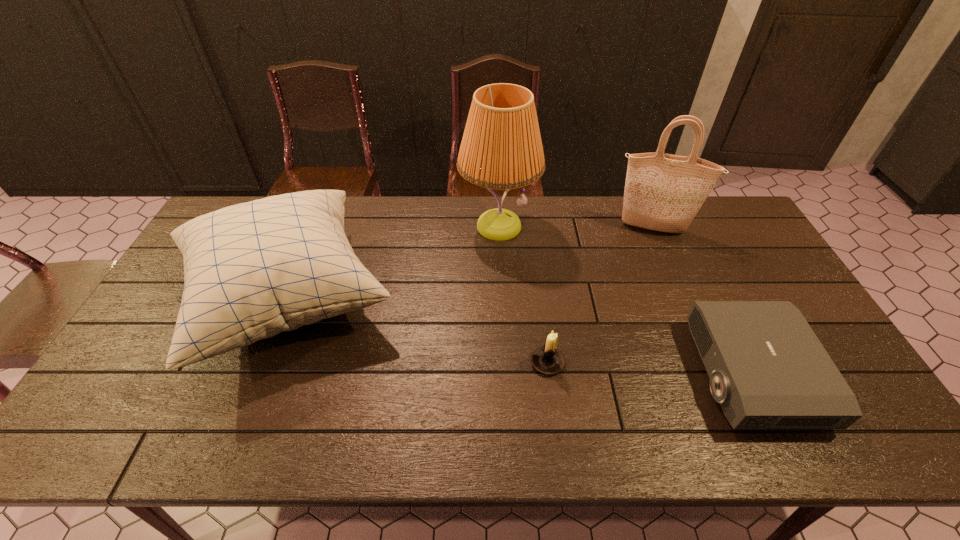
Where is `object present at the near right corner`? object present at the near right corner is located at coordinates (768, 370).

The image size is (960, 540). In the image, there is a desktop. Find the location of `free space at the far edge`. free space at the far edge is located at coordinates (368, 212).

I want to click on vacant space at the near edge of the desktop, so click(394, 438).

The width and height of the screenshot is (960, 540). In the image, there is a desktop. Identify the location of vacant region at the left edge. (107, 408).

Identify the location of free space at the right edge of the desktop. (777, 278).

You are a GUI agent. You are given a task and a screenshot of the screen. Output one action in this format:
    pyautogui.click(x=<x>, y=<y>)
    Task: Click on the vacant area at the far right corner
    
    Given the screenshot: What is the action you would take?
    pyautogui.click(x=724, y=214)

The width and height of the screenshot is (960, 540). I want to click on free spot between the shopping bag and the candle holder, so click(600, 295).

This screenshot has height=540, width=960. What are the coordinates of `free space between the shopping bag and the shortest object` in the screenshot? It's located at (703, 301).

You are a GUI agent. You are given a task and a screenshot of the screen. Output one action in this format:
    pyautogui.click(x=<x>, y=<y>)
    Task: Click on the free space between the second shortest object and the third tallest object
    This screenshot has width=960, height=540.
    Given the screenshot: What is the action you would take?
    click(419, 330)

At what (x,y) coordinates should I click in order to perform the action: click on empty space between the lamp and the shortest object. Please return your answer as a coordinate pair (x, y). Looking at the image, I should click on (625, 300).